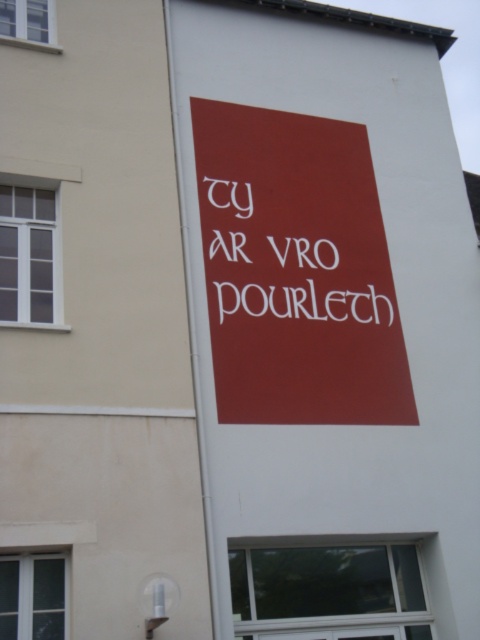
Between point (371, 384) and point (348, 273), which one is positioned in front?

Point (371, 384)

Based on the photo, is matte red sign at center taller than white matte sign at center?

Yes.

Who is more forward, [362,168] or [275,196]?

Point [275,196] is more forward.

Find the location of `matte red sign at center`. matte red sign at center is located at coordinates (297, 269).